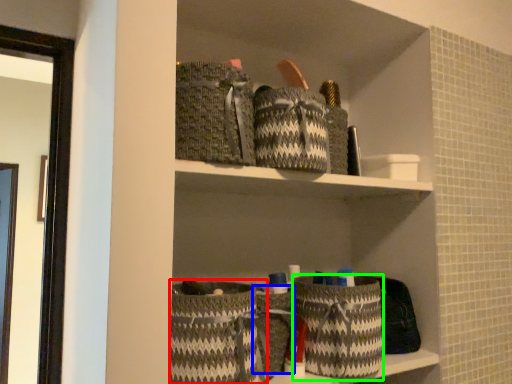
Question: Which object is positioned closest to basket (highlighted by a red box)? Select from basket (highlighted by a blue box) and basket (highlighted by a green box).

Choices:
 (A) basket
 (B) basket

Answer: (A)